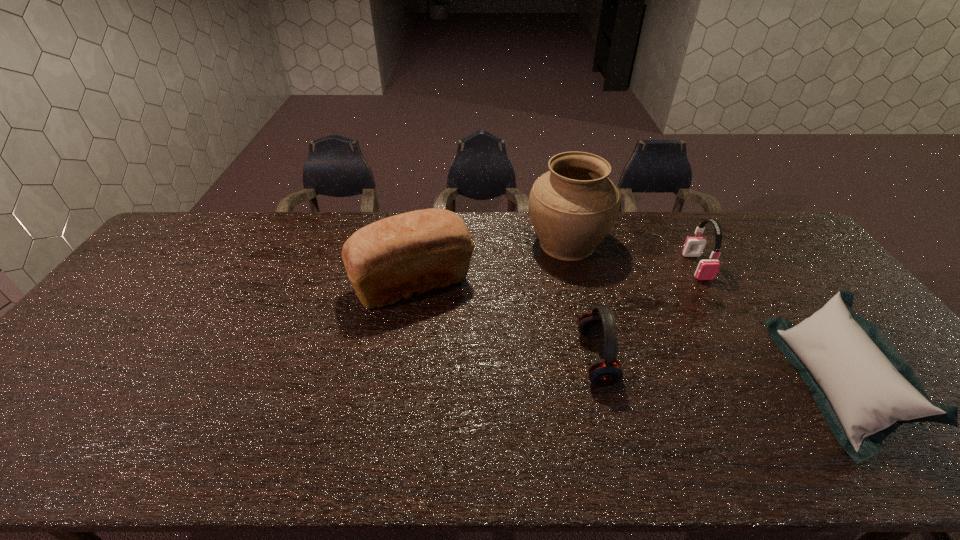
The width and height of the screenshot is (960, 540). What are the coordinates of `vacant space positioned on the ear cups of the left earphone` in the screenshot? It's located at (468, 359).

The height and width of the screenshot is (540, 960). What are the coordinates of `vacant space situated on the ear cups of the left earphone` in the screenshot? It's located at (511, 359).

This screenshot has height=540, width=960. In order to click on vacant space located on the ear cups of the left earphone in this screenshot , I will do `click(448, 359)`.

Image resolution: width=960 pixels, height=540 pixels. I want to click on free space located on the surface of the rightmost object, so click(x=738, y=384).

The height and width of the screenshot is (540, 960). I want to click on vacant space located 0.160m on the surface of the rightmost object, so pos(734,384).

Where is `vacant region located 0.250m on the surface of the rightmost object`? The image size is (960, 540). vacant region located 0.250m on the surface of the rightmost object is located at coordinates 697,384.

The height and width of the screenshot is (540, 960). Identify the location of object that is at the far edge. click(x=573, y=206).

I want to click on object situated at the near edge, so click(x=865, y=389).

The image size is (960, 540). What are the coordinates of `object present at the right edge` in the screenshot? It's located at (865, 389).

Where is `object located in the near right corner section of the desktop`? object located in the near right corner section of the desktop is located at coordinates (865, 389).